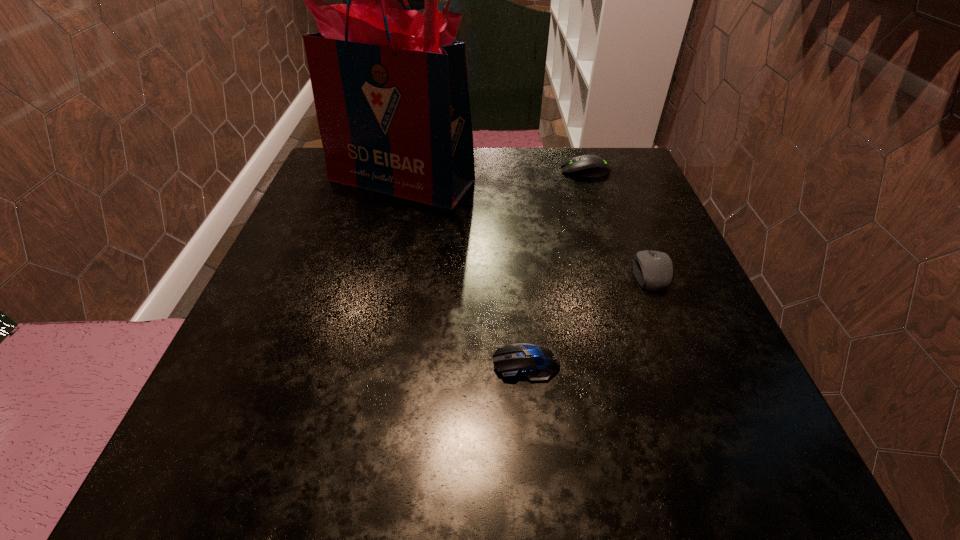
At what (x,y) coordinates should I click in order to perform the action: click on free space between the farthest computer mouse and the shortest computer mouse. Please return your answer as a coordinate pair (x, y). The width and height of the screenshot is (960, 540). Looking at the image, I should click on (556, 267).

Locate an element on the screen. vacant area between the shortest computer mouse and the tallest object is located at coordinates (464, 272).

Locate an element on the screen. The height and width of the screenshot is (540, 960). vacant region between the tallest object and the farthest computer mouse is located at coordinates (493, 176).

Where is `vacant area that lies between the farthest computer mouse and the tallest object`? vacant area that lies between the farthest computer mouse and the tallest object is located at coordinates (493, 176).

Where is `vacant point located between the leftmost object and the farthest computer mouse`? The width and height of the screenshot is (960, 540). vacant point located between the leftmost object and the farthest computer mouse is located at coordinates (x=493, y=176).

Find the location of a particular element. Image resolution: width=960 pixels, height=540 pixels. object that can be found as the second closest to the second object from left to right is located at coordinates (390, 87).

Select which object is the third closest to the farthest computer mouse. Please provide its 2D coordinates. Your answer should be formatted as a tuple, i.e. [(x, y)], where the tuple contains the x and y coordinates of a point satisfying the conditions above.

[(534, 363)]

Identify which computer mouse is located as the nearest to the farthest computer mouse. Please provide its 2D coordinates. Your answer should be formatted as a tuple, i.e. [(x, y)], where the tuple contains the x and y coordinates of a point satisfying the conditions above.

[(654, 271)]

Locate an element on the screen. The height and width of the screenshot is (540, 960). computer mouse that is the second closest one to the shortest object is located at coordinates (587, 166).

The width and height of the screenshot is (960, 540). In order to click on vacant area in the image that satisfies the following two spatial constraints: 1. on the wheel side of the farthest computer mouse; 2. on the back side of the second nearest computer mouse in this screenshot , I will do `click(619, 273)`.